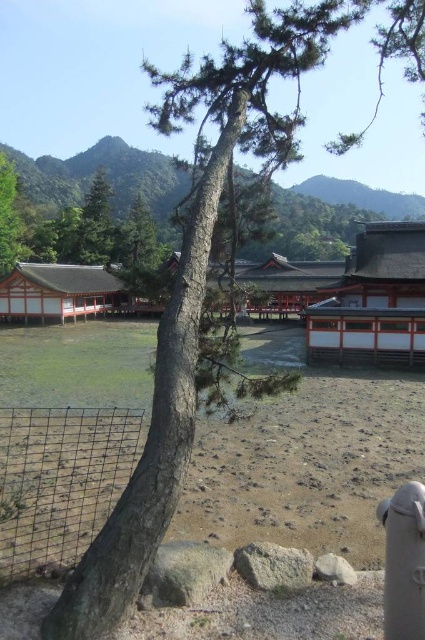
Question: Which of the following is the closest to the observer?

Choices:
 (A) green matte tree at upper center
 (B) black wire mesh at center
 (C) green leafy tree at left
 (D) brown sandy dirt at center

Answer: (B)

Question: Can you confirm if black wire mesh at center is positioned above green matte tree at upper center?

Choices:
 (A) no
 (B) yes

Answer: (A)

Question: Is black wire mesh at center further to camera compared to green leafy tree at left?

Choices:
 (A) no
 (B) yes

Answer: (A)

Question: Does brown sandy dirt at center lie in front of black wire mesh at center?

Choices:
 (A) yes
 (B) no

Answer: (B)

Question: Which of the following is the closest to the observer?

Choices:
 (A) green leafy tree at left
 (B) brown sandy dirt at center
 (C) black wire mesh at center
 (D) green matte tree at upper center

Answer: (C)

Question: Estimate the real-world distances between objects in this image. Which object is closer to the green leafy tree at left?

Choices:
 (A) black wire mesh at center
 (B) brown sandy dirt at center
 (C) green matte tree at upper center

Answer: (C)